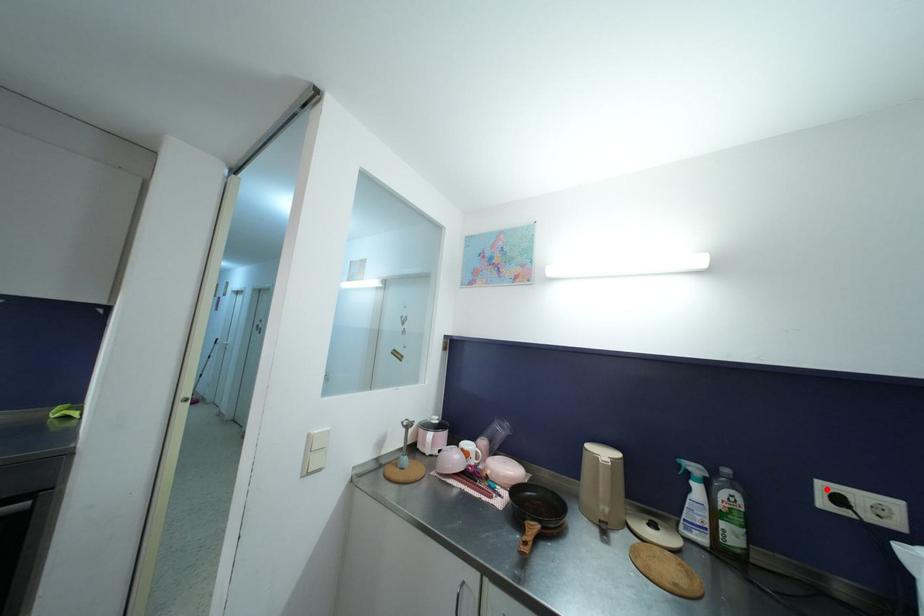
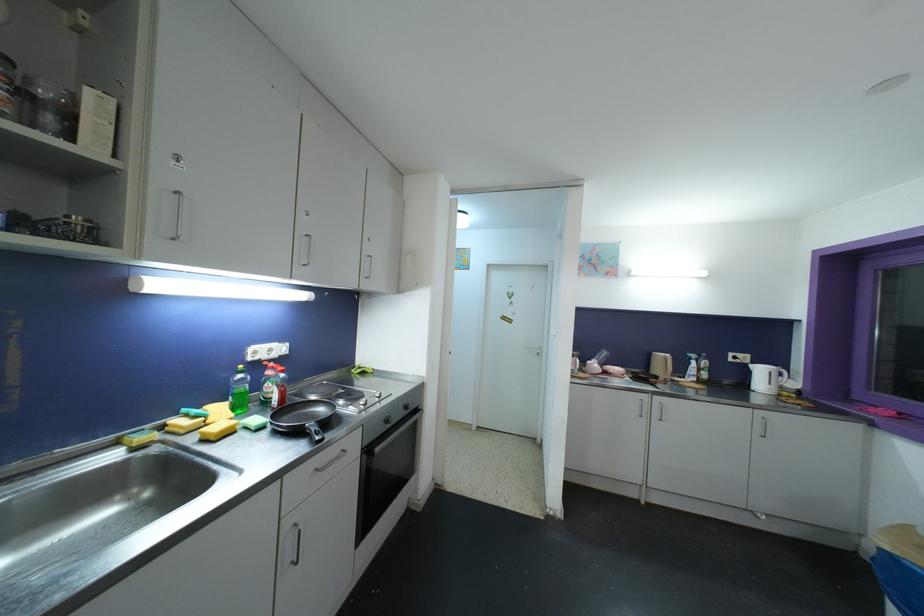
In the second image, find the point that corresponds to the highlighted location in the first image.

(734, 357)